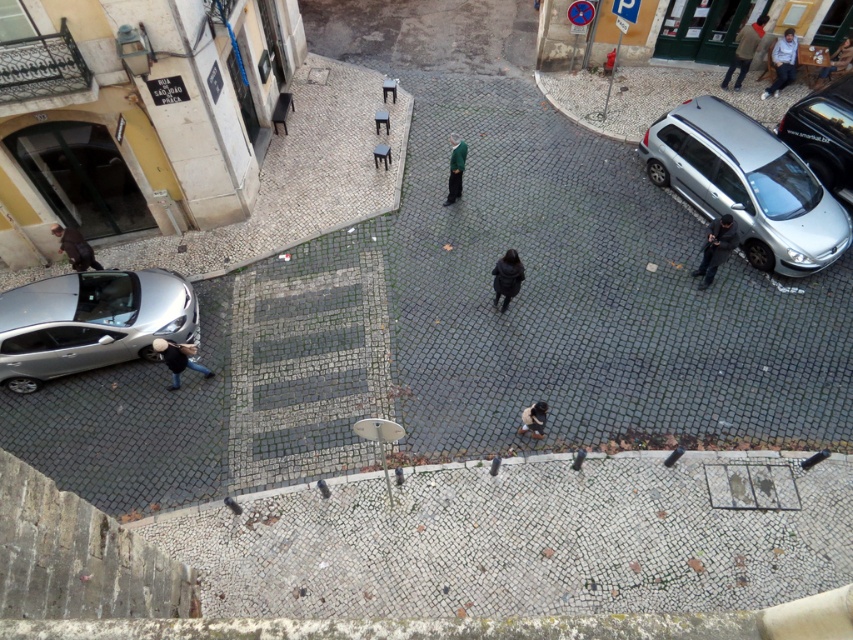
Does silver metallic car at lower left appear under black matte coat at center?

Correct, silver metallic car at lower left is located below black matte coat at center.

In the scene shown: Is silver metallic car at lower left above black matte coat at center?

Incorrect, silver metallic car at lower left is not positioned above black matte coat at center.

Locate an element on the screen. silver metallic car at lower left is located at coordinates (90, 323).

Can you confirm if light blue shirt at upper right is positioned to the right of dark blue jeans at lower left?

Indeed, light blue shirt at upper right is positioned on the right side of dark blue jeans at lower left.

The image size is (853, 640). I want to click on light blue shirt at upper right, so click(782, 61).

Who is more forward, (791, 67) or (172, 348)?

Positioned in front is point (172, 348).

Identify the location of light blue shirt at upper right. The image size is (853, 640). (782, 61).

Who is more distant from viewer, (161,342) or (498,262)?

The point (498,262) is more distant.

Is point (178, 353) closer to camera compared to point (503, 257)?

Yes, point (178, 353) is closer to viewer.

Describe the element at coordinates (178, 358) in the screenshot. The image size is (853, 640). I see `dark blue jeans at lower left` at that location.

Locate an element on the screen. The width and height of the screenshot is (853, 640). dark blue jeans at lower left is located at coordinates (178, 358).